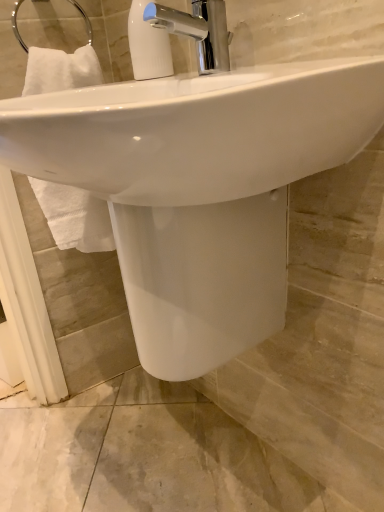
Measure the distance between point (195, 6) and camera.

They are 28.46 inches apart.

Measure the distance between point (160, 34) and camera.

The distance of point (160, 34) from camera is 29.41 inches.

Find the location of a particular element. chrome metallic faucet at upper center is located at coordinates (198, 31).

Based on the photo, is white plastic soap dispenser at upper center positioned with its back to white glossy sink at center?

No.

Is white plastic soap dispenser at upper center positioned far away from white glossy sink at center?

Actually, white plastic soap dispenser at upper center and white glossy sink at center are a little close together.

Considering the relative sizes of white plastic soap dispenser at upper center and white glossy sink at center in the image provided, is white plastic soap dispenser at upper center smaller than white glossy sink at center?

Yes, white plastic soap dispenser at upper center is smaller than white glossy sink at center.

Considering the relative sizes of white glossy sink at center and white plastic soap dispenser at upper center in the image provided, is white glossy sink at center thinner than white plastic soap dispenser at upper center?

No, white glossy sink at center is not thinner than white plastic soap dispenser at upper center.

What's the angular difference between white glossy sink at center and white plastic soap dispenser at upper center's facing directions?

0.00126 degrees separate the facing orientations of white glossy sink at center and white plastic soap dispenser at upper center.

Is white glossy sink at center at the right side of white plastic soap dispenser at upper center?

Correct, you'll find white glossy sink at center to the right of white plastic soap dispenser at upper center.

From a real-world perspective, is chrome metallic faucet at upper center above or below white glossy sink at center?

chrome metallic faucet at upper center is above white glossy sink at center.

Can we say chrome metallic faucet at upper center lies outside white glossy sink at center?

Yes, chrome metallic faucet at upper center is located beyond the bounds of white glossy sink at center.

Are white glossy sink at center and chrome metallic faucet at upper center located far from each other?

white glossy sink at center is near chrome metallic faucet at upper center, not far away.

Which object is more forward, white glossy sink at center or chrome metallic faucet at upper center?

white glossy sink at center.

Which object is positioned more to the right, white glossy sink at center or chrome metallic faucet at upper center?

From the viewer's perspective, chrome metallic faucet at upper center appears more on the right side.

Is point (207, 259) more distant than point (198, 3)?

No.

Consider the image. In terms of size, does white plastic soap dispenser at upper center appear bigger or smaller than chrome metallic faucet at upper center?

Clearly, white plastic soap dispenser at upper center is smaller in size than chrome metallic faucet at upper center.

From a real-world perspective, is white plastic soap dispenser at upper center positioned above or below chrome metallic faucet at upper center?

white plastic soap dispenser at upper center is situated higher than chrome metallic faucet at upper center in the real world.

Is white plastic soap dispenser at upper center outside of chrome metallic faucet at upper center?

Yes, white plastic soap dispenser at upper center is located beyond the bounds of chrome metallic faucet at upper center.

Considering the positions of points (165, 33) and (215, 11), is point (165, 33) closer to camera compared to point (215, 11)?

No, it is behind (215, 11).

Is chrome metallic faucet at upper center at the right side of white plastic soap dispenser at upper center?

Indeed, chrome metallic faucet at upper center is positioned on the right side of white plastic soap dispenser at upper center.

From the image's perspective, is chrome metallic faucet at upper center below white plastic soap dispenser at upper center?

Yes.

Does chrome metallic faucet at upper center have a smaller size compared to white plastic soap dispenser at upper center?

Actually, chrome metallic faucet at upper center might be larger than white plastic soap dispenser at upper center.

You are a GUI agent. You are given a task and a screenshot of the screen. Output one action in this format:
    pyautogui.click(x=<x>, y=<y>)
    Task: Click on the tap that is on the right side of white plastic soap dispenser at upper center
    
    Given the screenshot: What is the action you would take?
    point(198,31)

This screenshot has width=384, height=512. I want to click on soap dispenser that is above the white glossy sink at center (from a real-world perspective), so click(x=148, y=45).

The height and width of the screenshot is (512, 384). Identify the location of sink below the white plastic soap dispenser at upper center (from a real-world perspective). (199, 188).

From the image, which object appears to be farther from chrome metallic faucet at upper center, white glossy sink at center or white plastic soap dispenser at upper center?

Based on the image, white glossy sink at center appears to be further to chrome metallic faucet at upper center.

Looking at the image, which one is located further to white plastic soap dispenser at upper center, chrome metallic faucet at upper center or white glossy sink at center?

white glossy sink at center.

From the image, which object appears to be farther from white glossy sink at center, white plastic soap dispenser at upper center or chrome metallic faucet at upper center?

Among the two, white plastic soap dispenser at upper center is located further to white glossy sink at center.

Estimate the real-world distances between objects in this image. Which object is closer to white plastic soap dispenser at upper center, white glossy sink at center or chrome metallic faucet at upper center?

chrome metallic faucet at upper center is closer to white plastic soap dispenser at upper center.

When comparing their distances from chrome metallic faucet at upper center, does white plastic soap dispenser at upper center or white glossy sink at center seem further?

Among the two, white glossy sink at center is located further to chrome metallic faucet at upper center.

Looking at the image, which one is located further to white glossy sink at center, chrome metallic faucet at upper center or white plastic soap dispenser at upper center?

The object further to white glossy sink at center is white plastic soap dispenser at upper center.

Find the location of `tap between white plastic soap dispenser at upper center and white glossy sink at center in the up-down direction`. tap between white plastic soap dispenser at upper center and white glossy sink at center in the up-down direction is located at coordinates pyautogui.click(x=198, y=31).